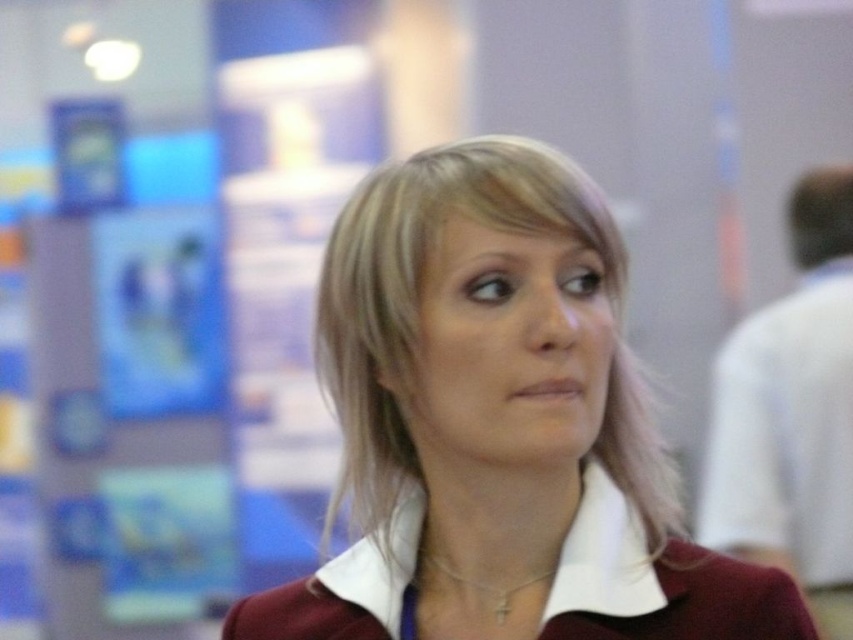
Question: Among these points, which one is farthest from the camera?

Choices:
 (A) (421, 580)
 (B) (619, 513)
 (C) (778, 547)

Answer: (C)

Question: Which object appears farthest from the camera in this image?

Choices:
 (A) gold chain necklace at center
 (B) maroon fabric shirt at center
 (C) white cotton shirt at center
 (D) white cotton dress shirt at right

Answer: (D)

Question: Estimate the real-world distances between objects in this image. Which object is closer to the white cotton dress shirt at right?

Choices:
 (A) maroon fabric shirt at center
 (B) white cotton shirt at center

Answer: (A)

Question: Can you confirm if maroon fabric shirt at center is positioned to the right of gold chain necklace at center?

Choices:
 (A) yes
 (B) no

Answer: (A)

Question: Can you confirm if maroon fabric shirt at center is bigger than white cotton shirt at center?

Choices:
 (A) no
 (B) yes

Answer: (B)

Question: Is maroon fabric shirt at center smaller than gold chain necklace at center?

Choices:
 (A) no
 (B) yes

Answer: (A)